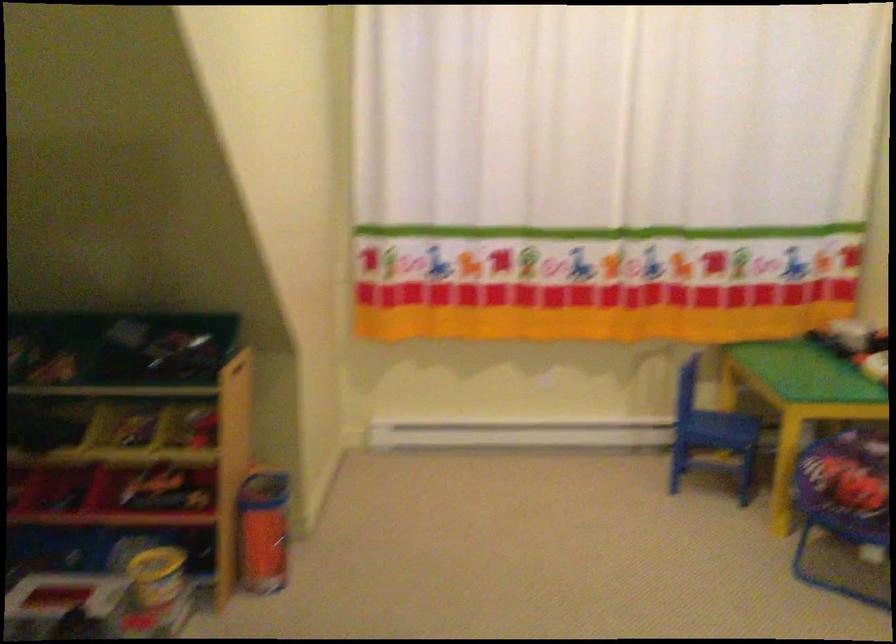
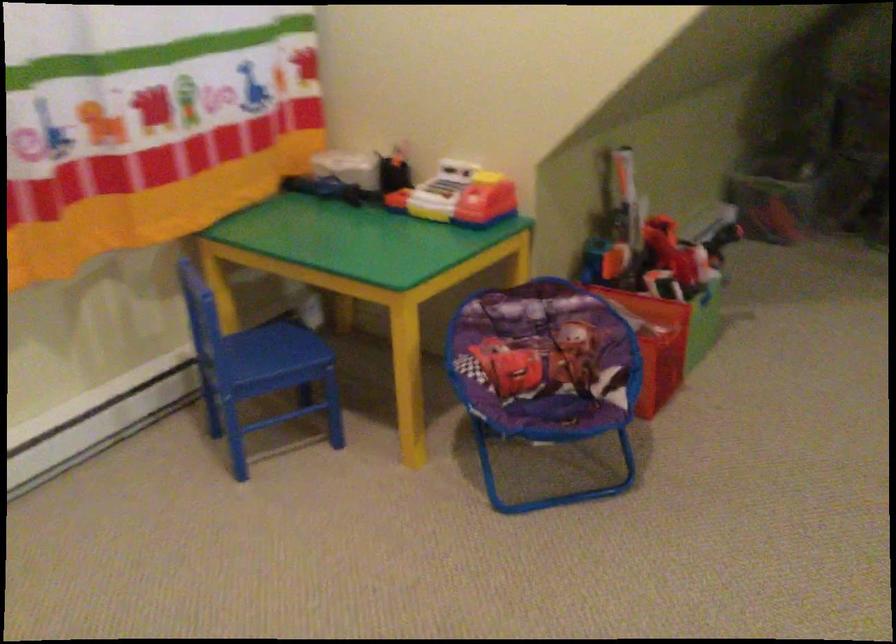
The point at (727,427) is marked in the first image. Where is the corresponding point in the second image?

(274, 348)